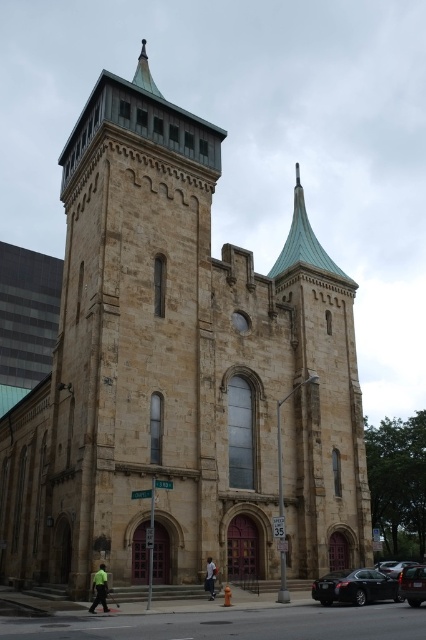
Is shiny black sedan at center bigger than dark blue jeans at center?

Yes, shiny black sedan at center is bigger than dark blue jeans at center.

Does shiny black sedan at center appear on the left side of dark blue jeans at center?

In fact, shiny black sedan at center is to the right of dark blue jeans at center.

Image resolution: width=426 pixels, height=640 pixels. I want to click on shiny black sedan at center, so click(x=394, y=566).

In the scene shown: Between green fabric person at lower left and dark blue jeans at center, which one is positioned lower?

dark blue jeans at center

Does green fabric person at lower left lie in front of dark blue jeans at center?

Yes.

Consider the image. Who is more distant from viewer, (94, 582) or (207, 556)?

Point (207, 556)

You are a GUI agent. You are given a task and a screenshot of the screen. Output one action in this format:
    pyautogui.click(x=<x>, y=<y>)
    Task: Click on the green fabric person at lower left
    The height and width of the screenshot is (640, 426).
    Given the screenshot: What is the action you would take?
    pyautogui.click(x=100, y=589)

Does point (403, 576) lie behind point (144, 51)?

No, it is not.

Who is more forward, (403,568) or (146,68)?

Positioned in front is point (146,68).

The image size is (426, 640). Identify the location of shiny black sedan at lower right. click(x=412, y=584).